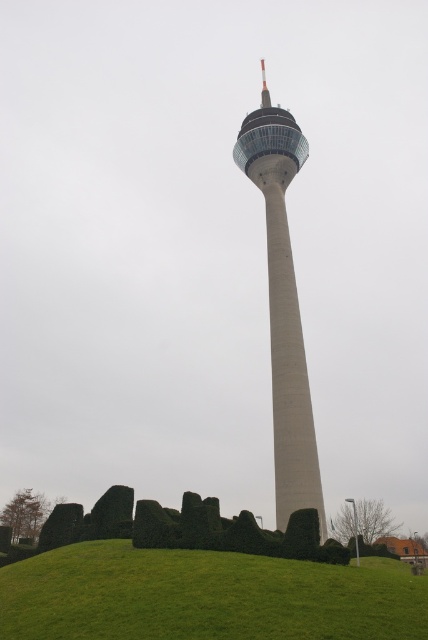
You are standing at the base of the smooth concrete tower at center and want to walk to the green bushy hedge at lower center. In which direction should you move?

You should move to the left because the smooth concrete tower at center is to the right of the green bushy hedge at lower center, so moving left will take you towards the hedge.

You are standing at the base of the tower and looking up towards the observation deck. Which object, the green grassy hill at lower center or the green bushy hedge at lower center, is closer to your viewpoint?

The green grassy hill at lower center is positioned under the green bushy hedge at lower center, so the green bushy hedge at lower center is closer to your viewpoint.

You are standing at the base of the tower and want to reach the observation deck. The green grassy hill at lower center is in your way. Can you walk around it? Please explain your reasoning based on the coordinates provided.

The green grassy hill at lower center is located at coordinates point (205, 596). Since coordinates are relative, it is possible to walk around it by moving either to the left or right of the hill to reach the observation deck.